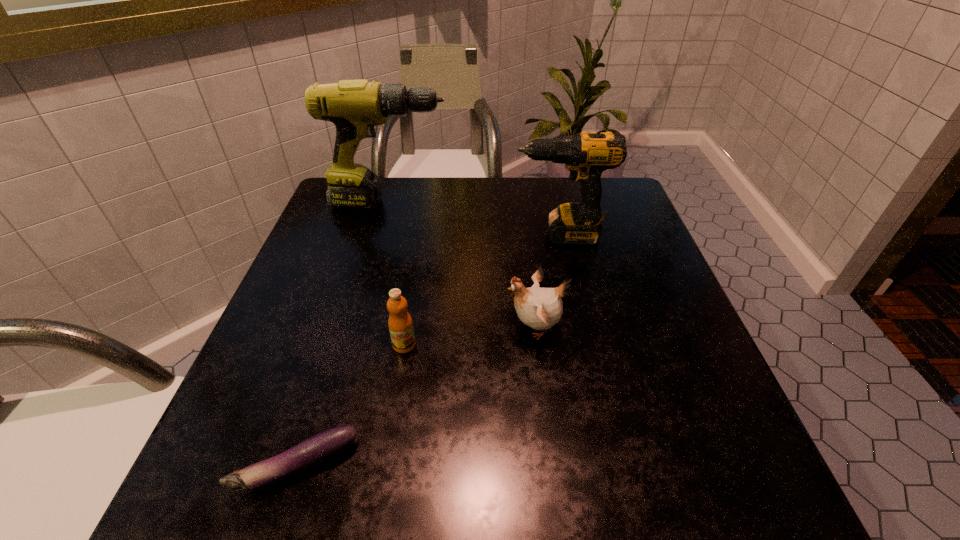
Where is `free space between the farthest object and the bird`? free space between the farthest object and the bird is located at coordinates (463, 265).

Where is `vacant space in between the shortest object and the farther drill`? The height and width of the screenshot is (540, 960). vacant space in between the shortest object and the farther drill is located at coordinates (344, 334).

The width and height of the screenshot is (960, 540). I want to click on vacant area that lies between the left drill and the bird, so click(x=463, y=265).

Identify the location of free space between the orange juice and the second farthest object. (482, 290).

Identify the location of vacant point located between the shorter drill and the bird. The image size is (960, 540). (547, 281).

You are a GUI agent. You are given a task and a screenshot of the screen. Output one action in this format:
    pyautogui.click(x=<x>, y=<y>)
    Task: Click on the blank region between the orange juice and the bird
    This screenshot has height=540, width=960.
    Given the screenshot: What is the action you would take?
    pyautogui.click(x=469, y=336)

Find the location of a particular element. free space between the bird and the right drill is located at coordinates (547, 281).

Where is `vacant area between the nearest object and the left drill`? This screenshot has height=540, width=960. vacant area between the nearest object and the left drill is located at coordinates (344, 334).

Locate an element on the screen. vacant area that lies between the bird and the nearer drill is located at coordinates (547, 281).

Locate an element on the screen. Image resolution: width=960 pixels, height=540 pixels. the closest object to the nearest object is located at coordinates [x=400, y=324].